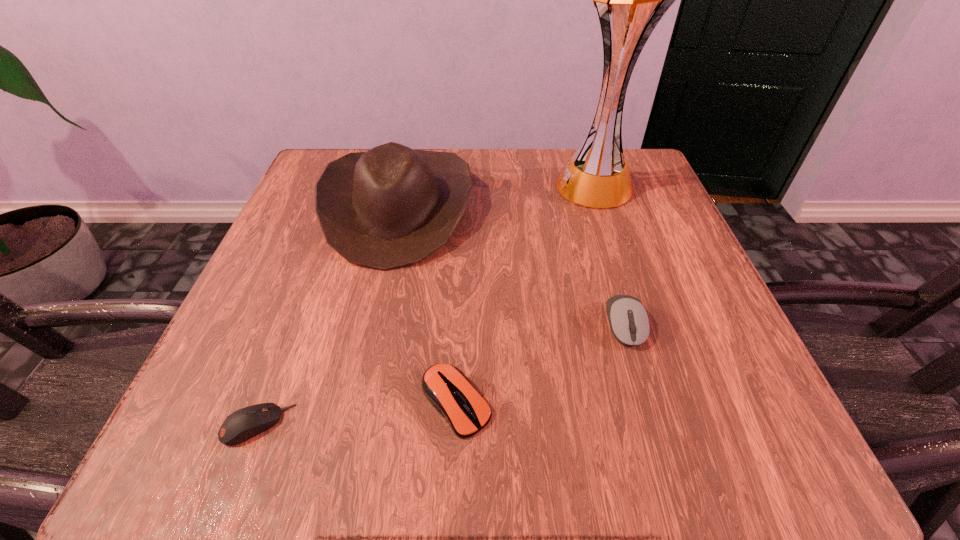
Identify the location of computer equipment present at the right edge. (628, 319).

Where is `object that is at the far left corner`? This screenshot has width=960, height=540. object that is at the far left corner is located at coordinates (392, 206).

The width and height of the screenshot is (960, 540). Find the location of `object at the near left corner`. object at the near left corner is located at coordinates (243, 424).

You are a GUI agent. You are given a task and a screenshot of the screen. Output one action in this format:
    pyautogui.click(x=<x>, y=<y>)
    Task: Click on the object that is at the far right corner
    The image size is (960, 540).
    Given the screenshot: What is the action you would take?
    pyautogui.click(x=630, y=0)

The height and width of the screenshot is (540, 960). In the image, there is a desktop. In order to click on vacant space at the far edge in this screenshot , I will do `click(481, 167)`.

At what (x,y) coordinates should I click in order to perform the action: click on free space at the near edge. Please return your answer as a coordinate pair (x, y). Looking at the image, I should click on (401, 408).

In the image, there is a desktop. Where is `free space at the left edge`? The width and height of the screenshot is (960, 540). free space at the left edge is located at coordinates pyautogui.click(x=279, y=384).

I want to click on free space at the right edge of the desktop, so click(661, 238).

Find the location of a particular element. Image resolution: width=960 pixels, height=540 pixels. vacant position at the near left corner of the desktop is located at coordinates (204, 402).

Find the location of a particular element. Image resolution: width=960 pixels, height=540 pixels. vacant space at the far right corner of the desktop is located at coordinates (654, 208).